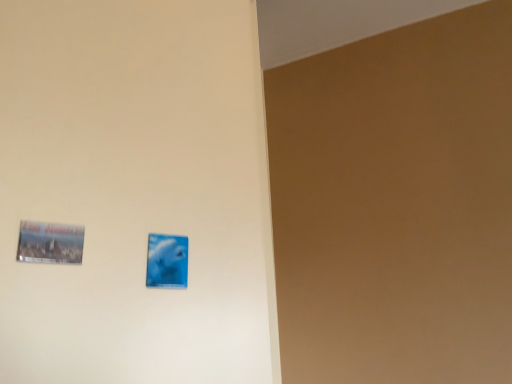
Find the location of a particular element. metallic silver picture frame at lower left, arranged as the second picture frame when viewed from the back is located at coordinates (50, 243).

What do you see at coordinates (50, 243) in the screenshot? I see `metallic silver picture frame at lower left, placed as the 1th picture frame when sorted from front to back` at bounding box center [50, 243].

How much space does blue glossy picture frame at center, acting as the second picture frame starting from the left, occupy vertically?

blue glossy picture frame at center, acting as the second picture frame starting from the left, is 3.18 inches tall.

Find the location of a particular element. The height and width of the screenshot is (384, 512). blue glossy picture frame at center, arranged as the 1th picture frame when viewed from the right is located at coordinates (167, 261).

The image size is (512, 384). Describe the element at coordinates (167, 261) in the screenshot. I see `blue glossy picture frame at center, the first picture frame when ordered from back to front` at that location.

Locate an element on the screen. This screenshot has width=512, height=384. metallic silver picture frame at lower left, which is counted as the second picture frame, starting from the right is located at coordinates click(50, 243).

Which is more to the left, metallic silver picture frame at lower left, marked as the first picture frame in a left-to-right arrangement, or blue glossy picture frame at center, acting as the second picture frame starting from the left?

metallic silver picture frame at lower left, marked as the first picture frame in a left-to-right arrangement, is more to the left.

Which object is further away from the camera taking this photo, metallic silver picture frame at lower left, placed as the 1th picture frame when sorted from front to back, or blue glossy picture frame at center, acting as the second picture frame starting from the left?

blue glossy picture frame at center, acting as the second picture frame starting from the left, is further away from the camera.

Is point (68, 259) behind point (179, 236)?

No, (68, 259) is in front of (179, 236).

From the image's perspective, does metallic silver picture frame at lower left, which is counted as the second picture frame, starting from the right, appear lower than blue glossy picture frame at center, the second picture frame from the front?

No.

From a real-world perspective, is metallic silver picture frame at lower left, arranged as the second picture frame when viewed from the back, below blue glossy picture frame at center, the second picture frame from the front?

Actually, metallic silver picture frame at lower left, arranged as the second picture frame when viewed from the back, is physically above blue glossy picture frame at center, the second picture frame from the front, in the real world.

Which object is wider, metallic silver picture frame at lower left, arranged as the second picture frame when viewed from the back, or blue glossy picture frame at center, the second picture frame from the front?

metallic silver picture frame at lower left, arranged as the second picture frame when viewed from the back.

Considering the sizes of objects metallic silver picture frame at lower left, marked as the first picture frame in a left-to-right arrangement, and blue glossy picture frame at center, the second picture frame from the front, in the image provided, who is taller, metallic silver picture frame at lower left, marked as the first picture frame in a left-to-right arrangement, or blue glossy picture frame at center, the second picture frame from the front,?

Standing taller between the two is blue glossy picture frame at center, the second picture frame from the front.

Considering the relative sizes of metallic silver picture frame at lower left, placed as the 1th picture frame when sorted from front to back, and blue glossy picture frame at center, acting as the second picture frame starting from the left, in the image provided, is metallic silver picture frame at lower left, placed as the 1th picture frame when sorted from front to back, smaller than blue glossy picture frame at center, acting as the second picture frame starting from the left,?

No, metallic silver picture frame at lower left, placed as the 1th picture frame when sorted from front to back, is not smaller than blue glossy picture frame at center, acting as the second picture frame starting from the left.

Is metallic silver picture frame at lower left, placed as the 1th picture frame when sorted from front to back, located outside blue glossy picture frame at center, the second picture frame from the front?

Indeed, metallic silver picture frame at lower left, placed as the 1th picture frame when sorted from front to back, is completely outside blue glossy picture frame at center, the second picture frame from the front.

Looking at this image, can you see metallic silver picture frame at lower left, placed as the 1th picture frame when sorted from front to back, touching blue glossy picture frame at center, the first picture frame when ordered from back to front?

No, metallic silver picture frame at lower left, placed as the 1th picture frame when sorted from front to back, is not touching blue glossy picture frame at center, the first picture frame when ordered from back to front.

Is metallic silver picture frame at lower left, placed as the 1th picture frame when sorted from front to back, oriented away from blue glossy picture frame at center, acting as the second picture frame starting from the left?

No, blue glossy picture frame at center, acting as the second picture frame starting from the left, is not at the back of metallic silver picture frame at lower left, placed as the 1th picture frame when sorted from front to back.

How much distance is there between metallic silver picture frame at lower left, marked as the first picture frame in a left-to-right arrangement, and blue glossy picture frame at center, arranged as the 1th picture frame when viewed from the right?

metallic silver picture frame at lower left, marked as the first picture frame in a left-to-right arrangement, and blue glossy picture frame at center, arranged as the 1th picture frame when viewed from the right, are 5.05 inches apart from each other.

The height and width of the screenshot is (384, 512). I want to click on picture frame below the metallic silver picture frame at lower left, placed as the 1th picture frame when sorted from front to back (from a real-world perspective), so click(167, 261).

Can you confirm if blue glossy picture frame at center, the first picture frame when ordered from back to front, is positioned to the right of metallic silver picture frame at lower left, placed as the 1th picture frame when sorted from front to back?

Indeed, blue glossy picture frame at center, the first picture frame when ordered from back to front, is positioned on the right side of metallic silver picture frame at lower left, placed as the 1th picture frame when sorted from front to back.

Considering the relative positions of blue glossy picture frame at center, acting as the second picture frame starting from the left, and metallic silver picture frame at lower left, arranged as the second picture frame when viewed from the back, in the image provided, is blue glossy picture frame at center, acting as the second picture frame starting from the left, behind metallic silver picture frame at lower left, arranged as the second picture frame when viewed from the back,?

Yes, it is behind metallic silver picture frame at lower left, arranged as the second picture frame when viewed from the back.

Which is closer, (166, 256) or (28, 258)?

Point (166, 256) is positioned farther from the camera compared to point (28, 258).

From the image's perspective, which one is positioned lower, blue glossy picture frame at center, acting as the second picture frame starting from the left, or metallic silver picture frame at lower left, which is counted as the second picture frame, starting from the right?

blue glossy picture frame at center, acting as the second picture frame starting from the left, is shown below in the image.

From a real-world perspective, is blue glossy picture frame at center, the first picture frame when ordered from back to front, positioned under metallic silver picture frame at lower left, placed as the 1th picture frame when sorted from front to back, based on gravity?

Yes, from a real-world perspective, blue glossy picture frame at center, the first picture frame when ordered from back to front, is under metallic silver picture frame at lower left, placed as the 1th picture frame when sorted from front to back.

In the scene shown: Is blue glossy picture frame at center, the first picture frame when ordered from back to front, wider than metallic silver picture frame at lower left, placed as the 1th picture frame when sorted from front to back?

Incorrect, the width of blue glossy picture frame at center, the first picture frame when ordered from back to front, does not surpass that of metallic silver picture frame at lower left, placed as the 1th picture frame when sorted from front to back.

Is blue glossy picture frame at center, acting as the second picture frame starting from the left, shorter than metallic silver picture frame at lower left, marked as the first picture frame in a left-to-right arrangement?

Incorrect, the height of blue glossy picture frame at center, acting as the second picture frame starting from the left, does not fall short of that of metallic silver picture frame at lower left, marked as the first picture frame in a left-to-right arrangement.

Considering the sizes of objects blue glossy picture frame at center, acting as the second picture frame starting from the left, and metallic silver picture frame at lower left, arranged as the second picture frame when viewed from the back, in the image provided, who is bigger, blue glossy picture frame at center, acting as the second picture frame starting from the left, or metallic silver picture frame at lower left, arranged as the second picture frame when viewed from the back,?

metallic silver picture frame at lower left, arranged as the second picture frame when viewed from the back.

From the picture: Is blue glossy picture frame at center, acting as the second picture frame starting from the left, completely or partially outside of metallic silver picture frame at lower left, which is counted as the second picture frame, starting from the right?

Yes, blue glossy picture frame at center, acting as the second picture frame starting from the left, is located beyond the bounds of metallic silver picture frame at lower left, which is counted as the second picture frame, starting from the right.

Is blue glossy picture frame at center, arranged as the 1th picture frame when viewed from the right, next to metallic silver picture frame at lower left, arranged as the second picture frame when viewed from the back, and touching it?

blue glossy picture frame at center, arranged as the 1th picture frame when viewed from the right, and metallic silver picture frame at lower left, arranged as the second picture frame when viewed from the back, are clearly separated.

Is blue glossy picture frame at center, acting as the second picture frame starting from the left, looking in the opposite direction of metallic silver picture frame at lower left, which is counted as the second picture frame, starting from the right?

No, blue glossy picture frame at center, acting as the second picture frame starting from the left,'s orientation is not away from metallic silver picture frame at lower left, which is counted as the second picture frame, starting from the right.

How different are the orientations of blue glossy picture frame at center, arranged as the 1th picture frame when viewed from the right, and metallic silver picture frame at lower left, placed as the 1th picture frame when sorted from front to back, in degrees?

The angle between the facing direction of blue glossy picture frame at center, arranged as the 1th picture frame when viewed from the right, and the facing direction of metallic silver picture frame at lower left, placed as the 1th picture frame when sorted from front to back, is 0.65 degrees.

This screenshot has height=384, width=512. In order to click on picture frame located on the right of metallic silver picture frame at lower left, placed as the 1th picture frame when sorted from front to back in this screenshot , I will do `click(167, 261)`.

The image size is (512, 384). I want to click on picture frame in front of the blue glossy picture frame at center, arranged as the 1th picture frame when viewed from the right, so click(50, 243).

Identify the location of picture frame located underneath the metallic silver picture frame at lower left, arranged as the second picture frame when viewed from the back (from a real-world perspective). Image resolution: width=512 pixels, height=384 pixels. (167, 261).